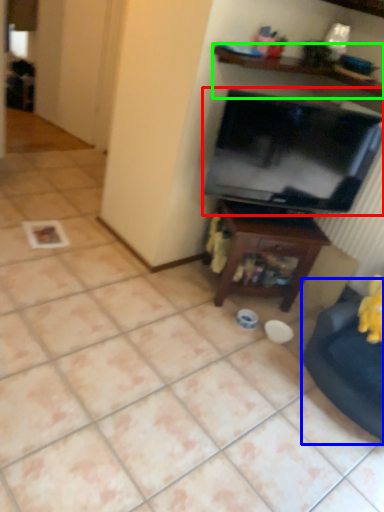
Question: Which is farther away from television (highlighted by a red box)? swivel chair (highlighted by a blue box) or shelf (highlighted by a green box)?

Choices:
 (A) swivel chair
 (B) shelf

Answer: (A)